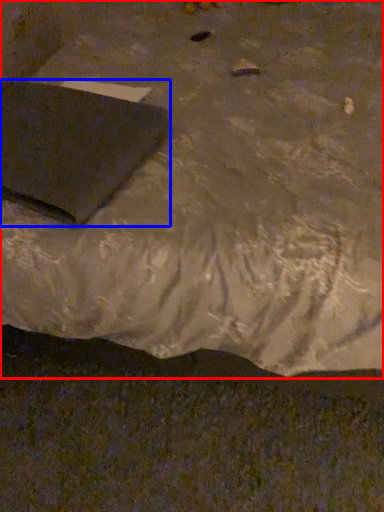
Question: Which object appears closest to the camera in this image, furniture (highlighted by a red box) or pad (highlighted by a blue box)?

Choices:
 (A) furniture
 (B) pad

Answer: (A)